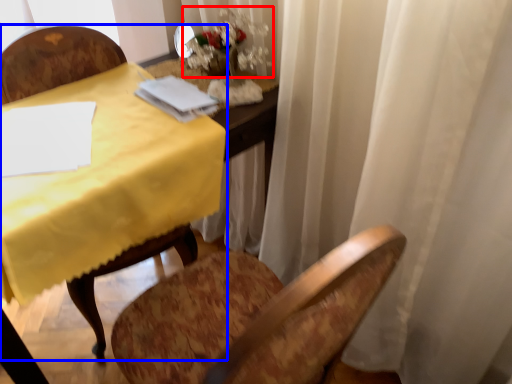
Question: Which object is closer to the camera taking this photo, floral arrangement (highlighted by a red box) or chair (highlighted by a blue box)?

Choices:
 (A) floral arrangement
 (B) chair

Answer: (B)